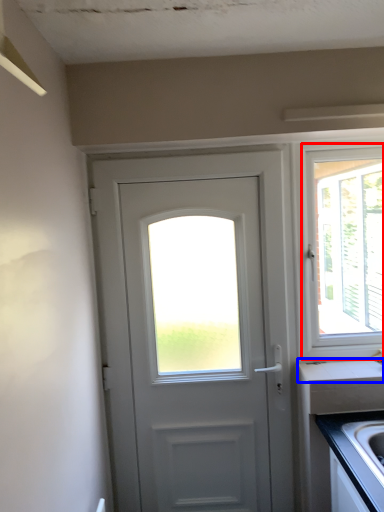
Question: Which point is closer to the camera, window (highlighted by a red box) or counter top (highlighted by a blue box)?

Choices:
 (A) window
 (B) counter top

Answer: (B)